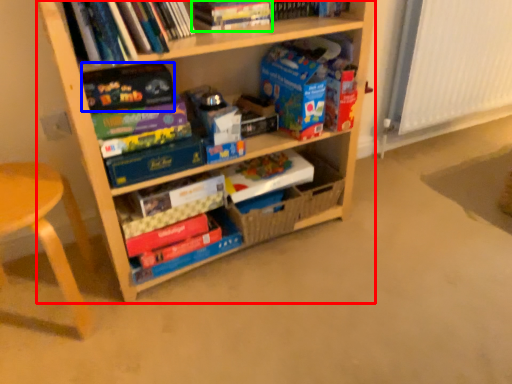
Question: Which is nearer to the shelf (highlighted by a red box)? paperback book (highlighted by a blue box) or book (highlighted by a green box).

Choices:
 (A) paperback book
 (B) book

Answer: (A)